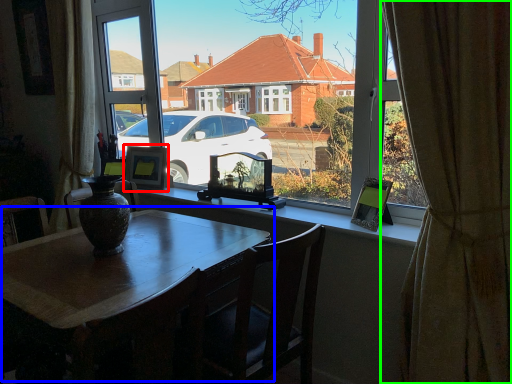
Question: Which is nearer to the picture frame (highlighted by a red box)? table (highlighted by a blue box) or curtain (highlighted by a green box).

Choices:
 (A) table
 (B) curtain

Answer: (A)